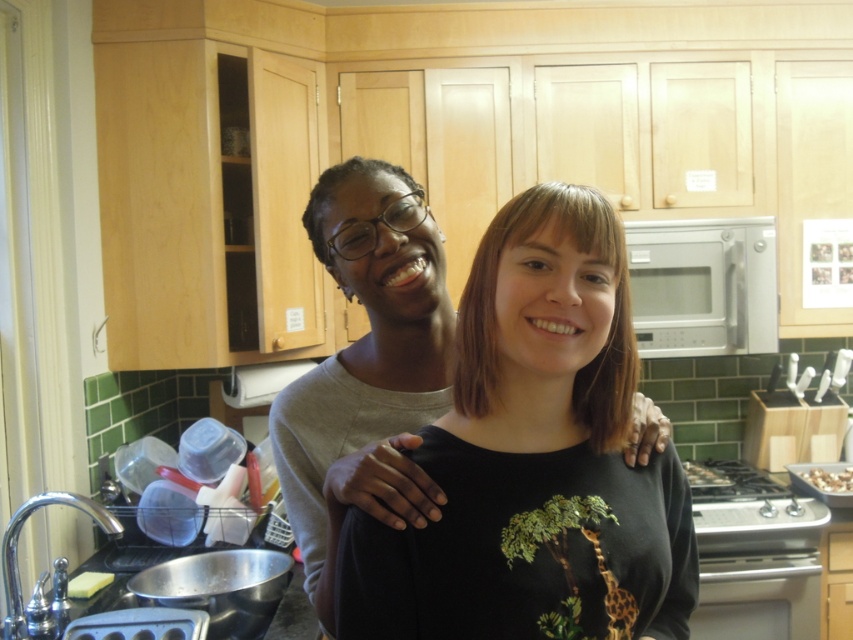
Measure the distance between matte gray sweater at center and satin silver microwave at right.

matte gray sweater at center and satin silver microwave at right are 1.48 meters apart.

Describe the element at coordinates (367, 369) in the screenshot. I see `matte gray sweater at center` at that location.

Who is more forward, (370, 288) or (642, 252)?

Point (370, 288) is in front.

At what (x,y) coordinates should I click in order to perform the action: click on matte gray sweater at center. Please return your answer as a coordinate pair (x, y). The height and width of the screenshot is (640, 853). Looking at the image, I should click on (367, 369).

Who is taller, shiny chocolate bar at right or shiny silver tray at stove right?

With more height is shiny silver tray at stove right.

Does shiny chocolate bar at right appear over shiny silver tray at stove right?

Correct, shiny chocolate bar at right is located above shiny silver tray at stove right.

Which is behind, point (825, 474) or point (699, 486)?

The point (825, 474) is more distant.

At what (x,y) coordinates should I click in order to perform the action: click on shiny chocolate bar at right. Please return your answer as a coordinate pair (x, y). Looking at the image, I should click on (828, 480).

Can you confirm if matte gray sweater at center is taller than shiny chocolate bar at right?

Indeed, matte gray sweater at center has a greater height compared to shiny chocolate bar at right.

Between point (335, 483) and point (838, 488), which one is positioned behind?

Point (838, 488)

Does point (642, 417) come in front of point (845, 472)?

That is True.

What are the coordinates of `matte gray sweater at center` in the screenshot? It's located at (367, 369).